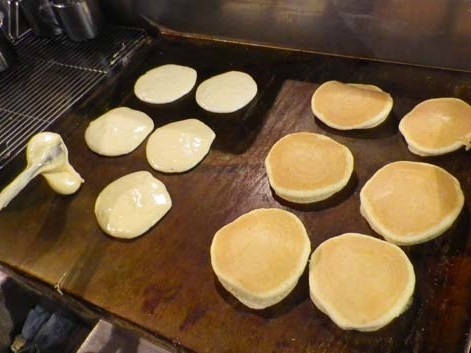
Where is `utensil`? utensil is located at coordinates (34, 173).